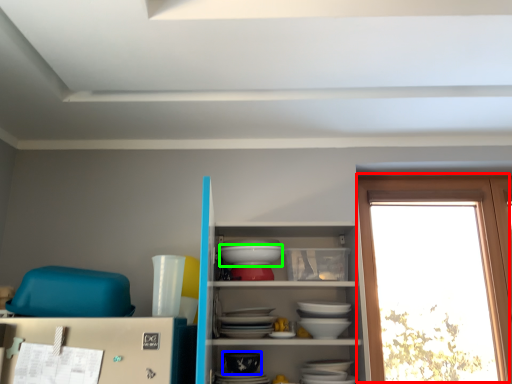
Question: Considering the real-world distances, which object is farthest from window (highlighted by a red box)? tableware (highlighted by a blue box) or table (highlighted by a green box)?

Choices:
 (A) tableware
 (B) table

Answer: (A)